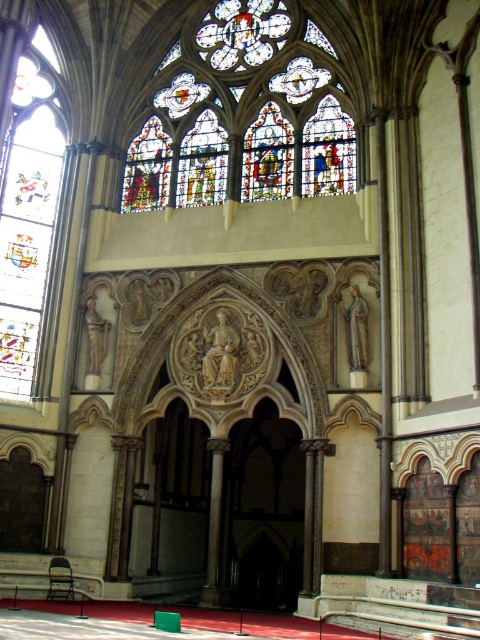
Based on the photo, you are an architect analyzing the church interior. You need to determine which stained glass has a greater height between the stained glass at upper center and the stained glass window at left. Which one is taller?

The stained glass window at left is taller than the stained glass at upper center because the description states that the stained glass at upper center is not as tall as the stained glass window at left.

You are an art historian examining the Gothic church interior. You notice two stained glass pieces in the scene. Which one is bigger in size between the stained glass at upper center and the stained glass window at left?

The stained glass at upper center is larger in size compared to the stained glass window at left.

You are a maintenance worker needing to inspect both the stained glass at upper center and the stained glass window at left. Given that your ladder can only reach up to 15 meters, can you safely inspect both without moving the ladder?

The stained glass at upper center and stained glass window at left are 16.55 meters apart from each other, which exceeds the ladder capacity of 15 meters. Therefore, you cannot safely inspect both without moving the ladder.